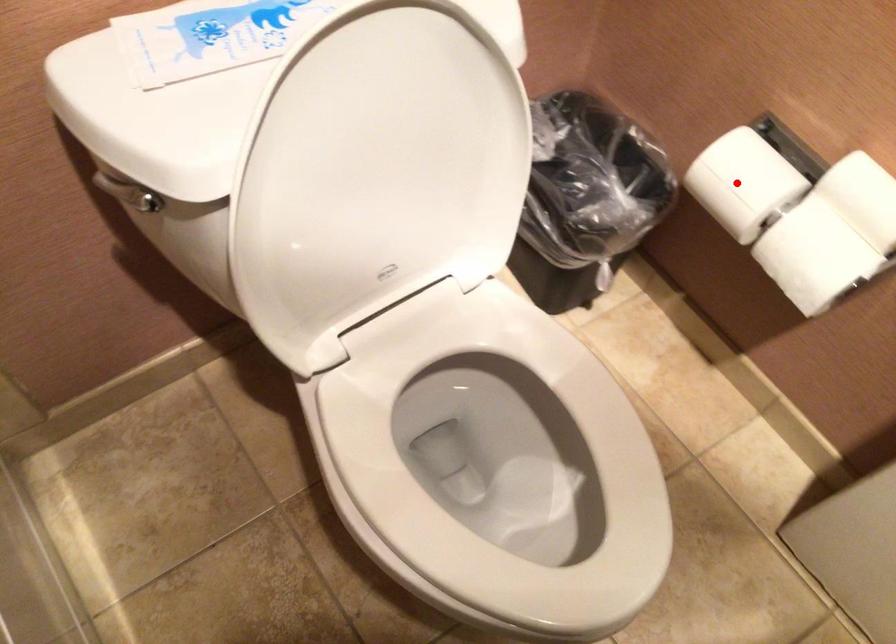
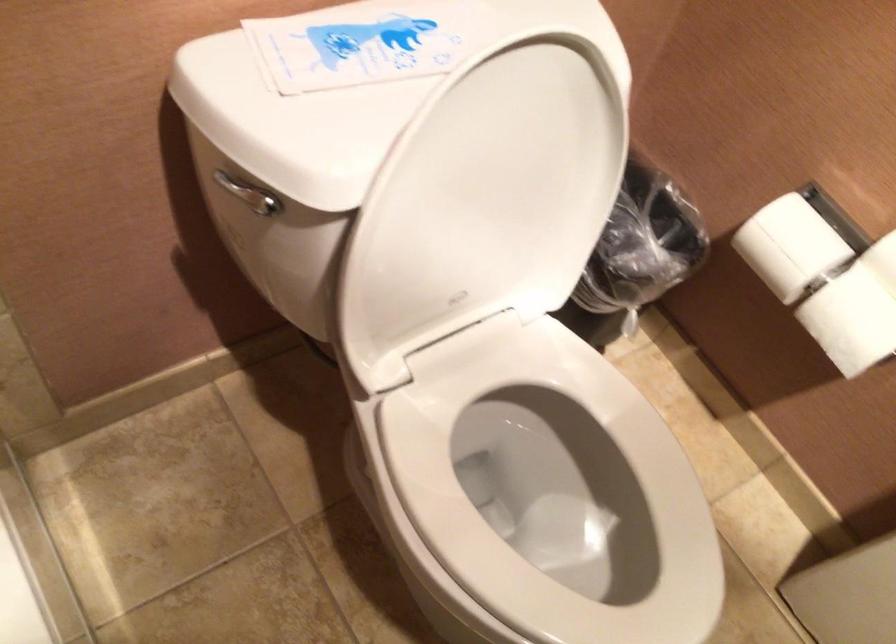
Where in the second image is the point corresponding to the highlighted location from the first image?

(789, 245)